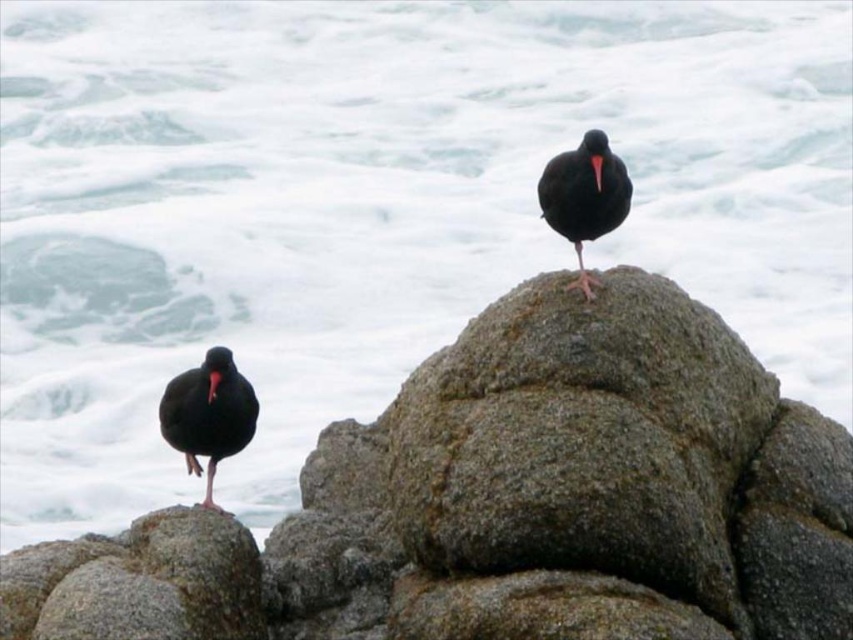
Does shiny black bird at center appear under black matte beak at upper center?

Yes, shiny black bird at center is below black matte beak at upper center.

Can you confirm if shiny black bird at center is positioned to the left of black matte beak at upper center?

Indeed, shiny black bird at center is positioned on the left side of black matte beak at upper center.

The height and width of the screenshot is (640, 853). Find the location of `shiny black bird at center`. shiny black bird at center is located at coordinates (583, 196).

The height and width of the screenshot is (640, 853). I want to click on gray rough rock at lower left, so click(x=509, y=500).

Does point (549, 520) come farther from viewer compared to point (598, 176)?

No, it is in front of (598, 176).

This screenshot has height=640, width=853. What do you see at coordinates (509, 500) in the screenshot?
I see `gray rough rock at lower left` at bounding box center [509, 500].

Find the location of `gray rough rock at lower left`. gray rough rock at lower left is located at coordinates (509, 500).

Which is below, black matte beak at upper center or black glossy beak at lower left?

black glossy beak at lower left

Which is more to the left, black matte beak at upper center or black glossy beak at lower left?

black glossy beak at lower left is more to the left.

At what (x,y) coordinates should I click in order to perform the action: click on black matte beak at upper center. Please return your answer as a coordinate pair (x, y). Image resolution: width=853 pixels, height=640 pixels. Looking at the image, I should click on (596, 170).

The image size is (853, 640). What are the coordinates of `black matte beak at upper center` in the screenshot? It's located at (596, 170).